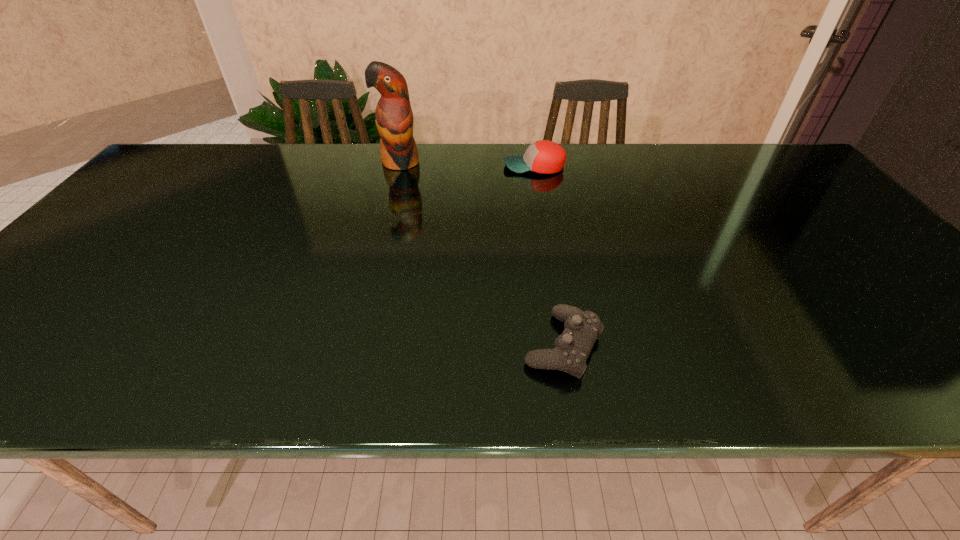
The image size is (960, 540). I want to click on free area in between the parrot and the baseball cap, so pyautogui.click(x=468, y=164).

Locate an element on the screen. The height and width of the screenshot is (540, 960). empty location between the nearest object and the baseball cap is located at coordinates (548, 255).

The image size is (960, 540). In order to click on empty space between the tallest object and the baseball cap in this screenshot , I will do `click(468, 164)`.

Image resolution: width=960 pixels, height=540 pixels. In order to click on unoccupied area between the tallest object and the baseball cap in this screenshot , I will do click(468, 164).

Where is `vacant point located between the tallest object and the shortest object`? This screenshot has width=960, height=540. vacant point located between the tallest object and the shortest object is located at coordinates (482, 254).

At what (x,y) coordinates should I click in order to perform the action: click on empty location between the tallest object and the baseball cap. Please return your answer as a coordinate pair (x, y). Looking at the image, I should click on (468, 164).

Identify the location of free space that is in between the shortest object and the parrot. The height and width of the screenshot is (540, 960). (482, 254).

Select which object appears as the closest to the baseball cap. Please provide its 2D coordinates. Your answer should be formatted as a tuple, i.e. [(x, y)], where the tuple contains the x and y coordinates of a point satisfying the conditions above.

[(394, 119)]

Where is `object that can be found as the second closest to the leftmost object`? The width and height of the screenshot is (960, 540). object that can be found as the second closest to the leftmost object is located at coordinates (572, 348).

You are a GUI agent. You are given a task and a screenshot of the screen. Output one action in this format:
    pyautogui.click(x=<x>, y=<y>)
    Task: Click on the free space that satisfies the following two spatial constraints: 1. on the face of the nearest object; 2. on the left side of the leftmost object
    
    Given the screenshot: What is the action you would take?
    pyautogui.click(x=353, y=345)